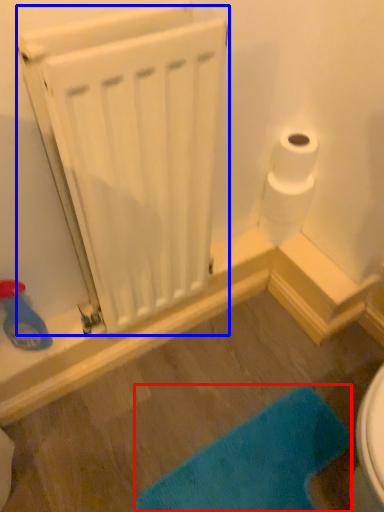
Question: Which object appears farthest to the camera in this image, bath mat (highlighted by a red box) or radiator (highlighted by a blue box)?

Choices:
 (A) bath mat
 (B) radiator

Answer: (A)